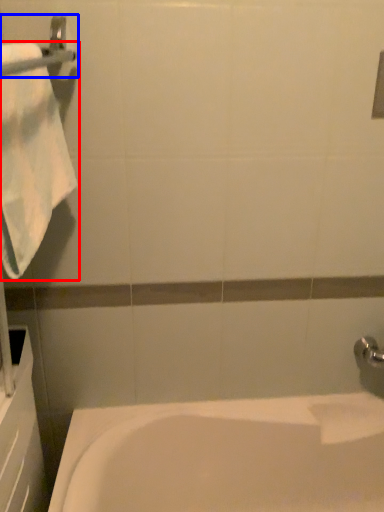
Question: Which object is further to the camera taking this photo, towel (highlighted by a red box) or towel bar (highlighted by a blue box)?

Choices:
 (A) towel
 (B) towel bar

Answer: (A)